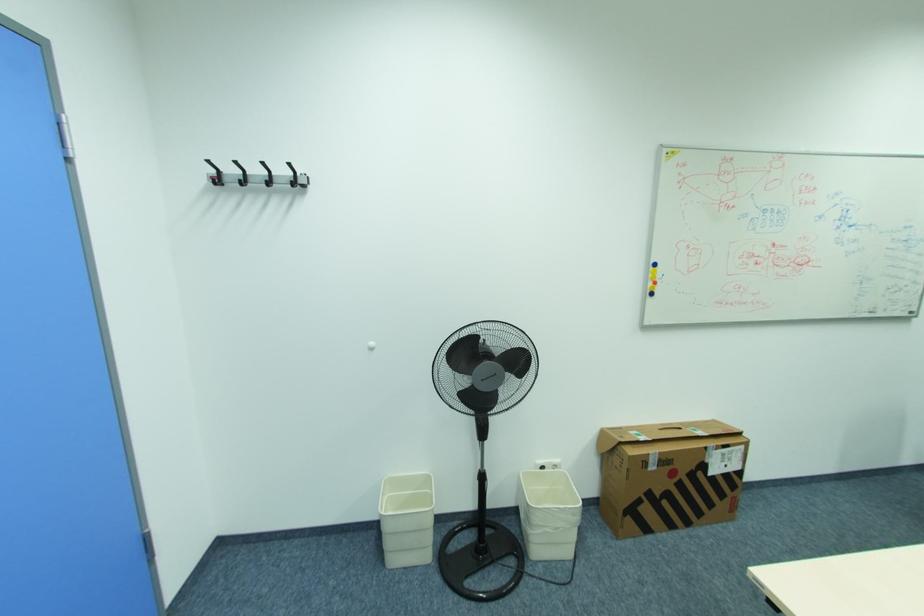
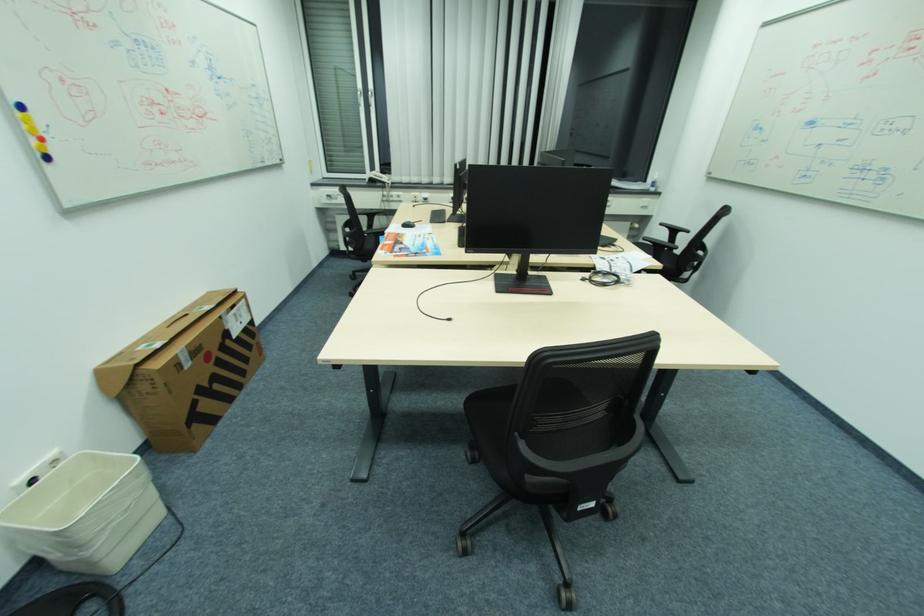
In the second image, find the point that corresponds to point (653, 455) in the first image.

(181, 355)